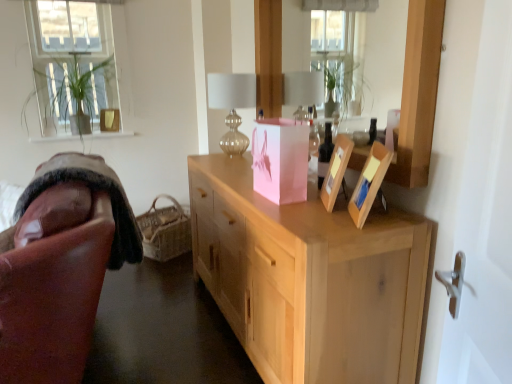
Question: In terms of size, does translucent glass bottle at center appear bigger or smaller than pink paper bag at center?

Choices:
 (A) big
 (B) small

Answer: (B)

Question: Considering the positions of translucent glass bottle at center and pink paper bag at center in the image, is translucent glass bottle at center wider or thinner than pink paper bag at center?

Choices:
 (A) thin
 (B) wide

Answer: (A)

Question: Which is nearer to the clear glass window at upper left?

Choices:
 (A) wooden mirror at upper center
 (B) translucent glass table lamp at center
 (C) translucent glass bottle at center
 (D) woven natural basket at lower left
 (E) natural wood cabinet at center

Answer: (D)

Question: Which is farther from the woven natural basket at lower left?

Choices:
 (A) translucent glass table lamp at center
 (B) natural wood cabinet at center
 (C) clear glass window at upper left
 (D) pink paper bag at center
 (E) translucent glass bottle at center

Answer: (D)